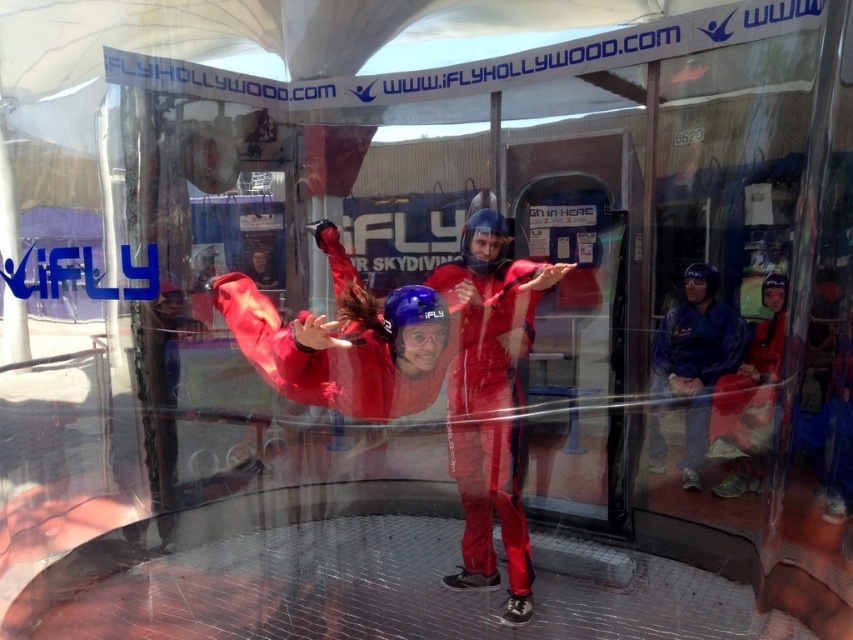
You are a visitor at the iFly Hollywood skydiving facility. You see the blue fabric jacket at right and the matte blue helmet at upper right through the glass wall. Which object is closer to the left side of the glass wall?

The blue fabric jacket at right is to the left of the matte blue helmet at upper right, so the blue fabric jacket at right is closer to the left side of the glass wall.

You are a photographer standing outside the skydiving facility and want to take a clear photo of the blue fabric jacket at right and the matte blue helmet at upper right. Which object will appear closer to you in the photo?

The blue fabric jacket at right will appear closer to you in the photo because it is further to the viewer than the matte blue helmet at upper right, meaning it is positioned nearer to your vantage point outside the facility.